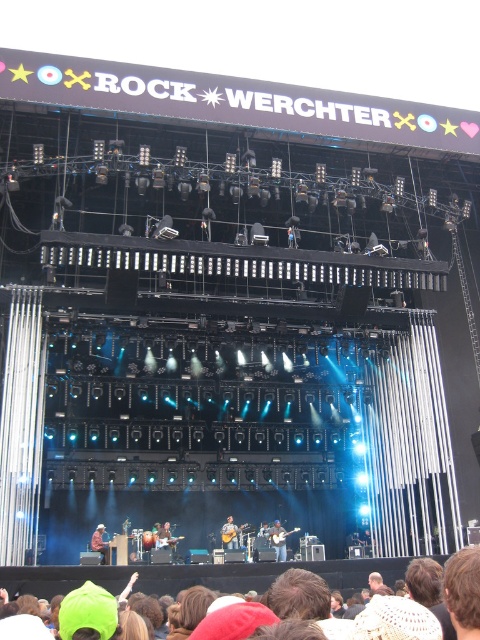
You are a photographer standing at the front of the stage at Rock Werchter festival. You want to take a photo that includes both the point at coordinate point (223, 544) and point at coordinate point (98, 548). Which point will appear closer to the bottom of the photo?

Point (98, 548) will appear closer to the bottom of the photo because it is closer to the camera than point (223, 544), which is further away.

You are a photographer at the Rock Werchter festival and need to capture a closeup of both the light brown wood guitar at center and the shiny brown guitar at center. Since you can only focus on one guitar at a time, which guitar should you choose to ensure the thinner one is in focus?

The light brown wood guitar at center is thinner than the shiny brown guitar at center, so you should focus on the light brown wood guitar at center to ensure it is in focus.